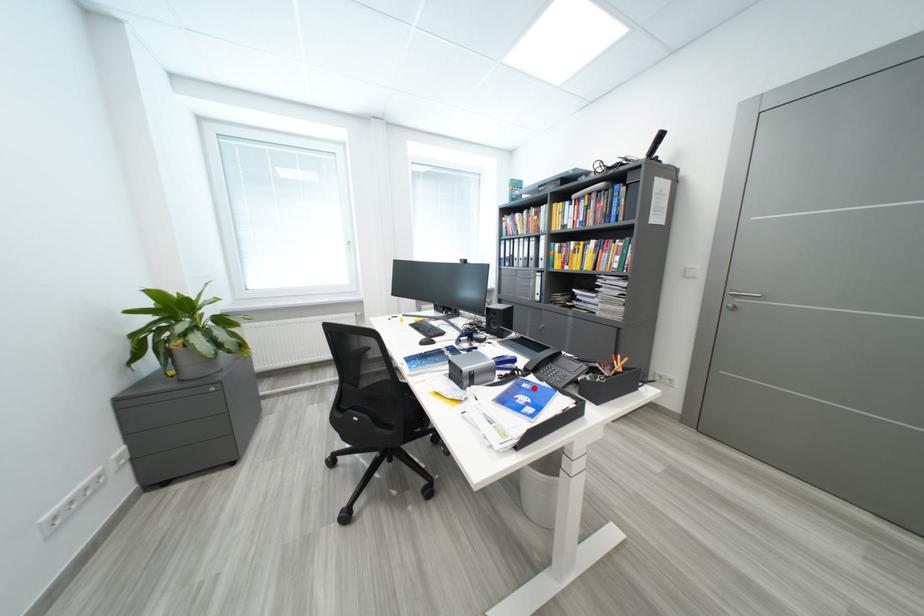
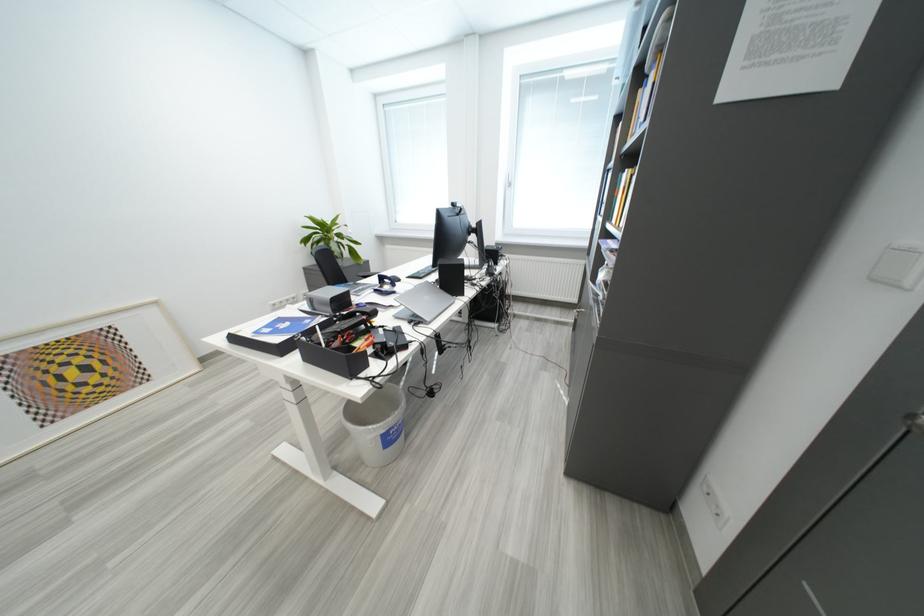
The point at the highlighted location is marked in the first image. Where is the corresponding point in the second image?

(317, 323)